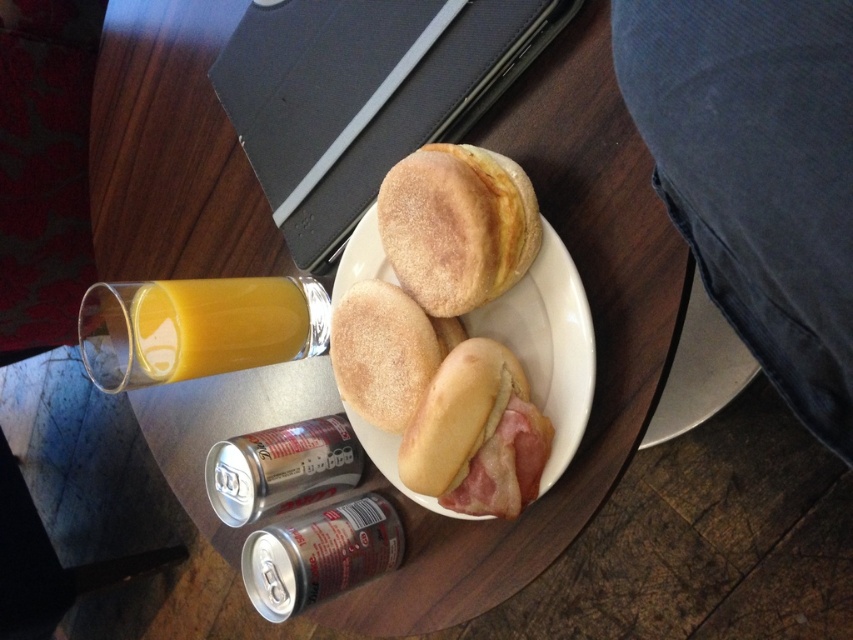
Between point (283, 540) and point (442, 410), which one is positioned behind?

Point (283, 540)

In the scene shown: Is silver metallic can at lower center closer to camera compared to golden brown bread at center?

That is False.

Is point (402, 552) in front of point (445, 381)?

No, it is not.

This screenshot has height=640, width=853. Identify the location of silver metallic can at lower center. (320, 554).

Which is behind, point (219, 314) or point (450, 396)?

The point (219, 314) is behind.

Consider the image. Does translucent glass orange juice at left have a lesser height compared to golden brown bread at center?

In fact, translucent glass orange juice at left may be taller than golden brown bread at center.

Is point (154, 358) positioned behind point (440, 387)?

Yes.

In order to click on translucent glass orange juice at left in this screenshot , I will do `click(196, 326)`.

Who is more distant from viewer, [413,253] or [450,483]?

The point [413,253] is more distant.

Can you confirm if golden brown muffins at center is thinner than golden brown bread at center?

In fact, golden brown muffins at center might be wider than golden brown bread at center.

Locate an element on the screen. golden brown muffins at center is located at coordinates (457, 227).

You are a GUI agent. You are given a task and a screenshot of the screen. Output one action in this format:
    pyautogui.click(x=<x>, y=<y>)
    Task: Click on the golden brown muffins at center
    The image size is (853, 640).
    Given the screenshot: What is the action you would take?
    pyautogui.click(x=457, y=227)